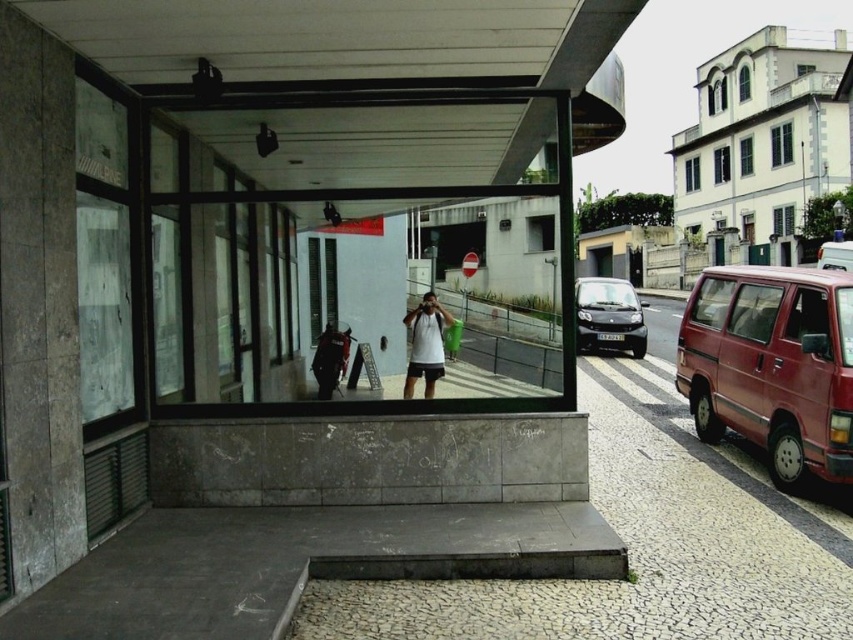
Does point (602, 337) come in front of point (831, 260)?

Yes.

Does shiny black car at center have a larger size compared to metallic silver van at right?

Correct, shiny black car at center is larger in size than metallic silver van at right.

Between point (596, 314) and point (833, 262), which one is positioned behind?

Positioned behind is point (833, 262).

Image resolution: width=853 pixels, height=640 pixels. I want to click on shiny black car at center, so click(608, 316).

Is point (567, 588) behind point (444, 310)?

No, (567, 588) is in front of (444, 310).

The image size is (853, 640). Describe the element at coordinates (641, 540) in the screenshot. I see `gray concrete pavement at center` at that location.

Find the location of `gray concrete pavement at center`. gray concrete pavement at center is located at coordinates (641, 540).

Is matte red van at right above white matte shirt at center?

Yes.

Can you confirm if matte red van at right is positioned below white matte shirt at center?

No.

Measure the distance between matte red van at right and camera.

matte red van at right is 6.13 meters from camera.

Find the location of a particular element. matte red van at right is located at coordinates (772, 365).